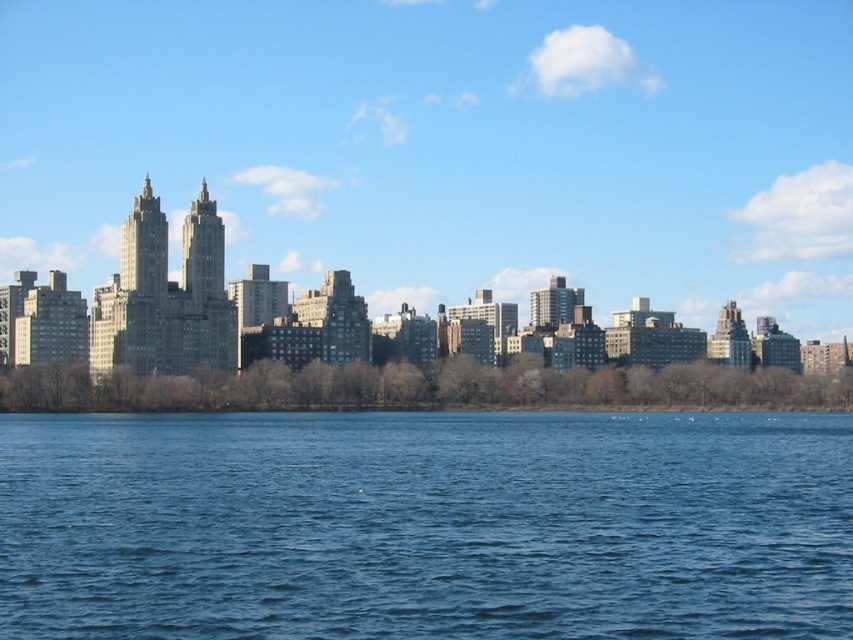
Between transparent glass buildings at center and gray concrete buildings at center, which one is positioned higher?

transparent glass buildings at center is higher up.

In the scene shown: Which of these two, transparent glass buildings at center or gray concrete buildings at center, stands taller?

With more height is transparent glass buildings at center.

Which is behind, point (672, 136) or point (231, 320)?

The point (672, 136) is more distant.

What are the coordinates of `transparent glass buildings at center` in the screenshot? It's located at (448, 147).

Does point (438, 104) lie behind point (247, 464)?

That is True.

Is transparent glass buildings at center positioned before blue liquid water at center?

No, transparent glass buildings at center is further to the viewer.

The image size is (853, 640). What do you see at coordinates (448, 147) in the screenshot?
I see `transparent glass buildings at center` at bounding box center [448, 147].

Where is `transparent glass buildings at center`? The image size is (853, 640). transparent glass buildings at center is located at coordinates (448, 147).

Who is higher up, blue liquid water at center or gray concrete buildings at center?

gray concrete buildings at center

Is blue liquid water at center further to the viewer compared to gray concrete buildings at center?

That is False.

Based on the photo, who is more distant from viewer, (369, 531) or (27, 289)?

The point (27, 289) is more distant.

Where is `blue liquid water at center`? This screenshot has height=640, width=853. blue liquid water at center is located at coordinates (426, 524).